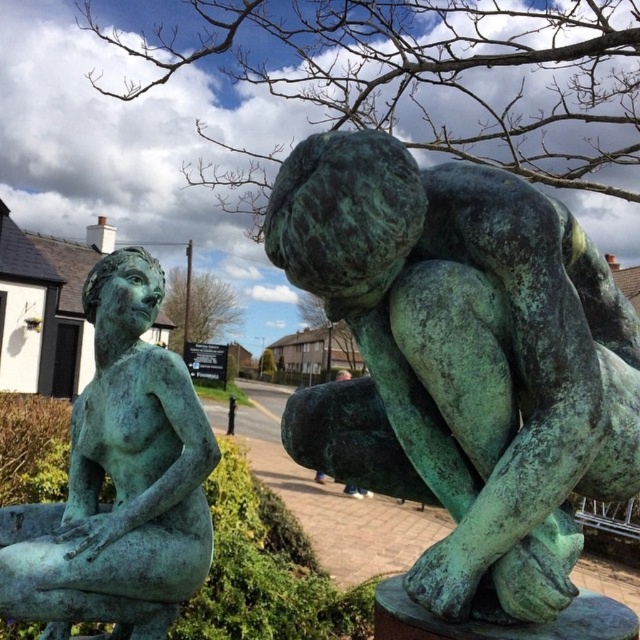
Question: Can you confirm if green patina statue at center is positioned to the right of green patina statue at left?

Choices:
 (A) no
 (B) yes

Answer: (B)

Question: Can you confirm if green patina statue at center is positioned above green patina statue at left?

Choices:
 (A) yes
 (B) no

Answer: (A)

Question: Considering the relative positions of green patina statue at center and green patina statue at left in the image provided, where is green patina statue at center located with respect to green patina statue at left?

Choices:
 (A) right
 (B) left

Answer: (A)

Question: Which object appears farthest from the camera in this image?

Choices:
 (A) green patina statue at center
 (B) green patina statue at left

Answer: (B)